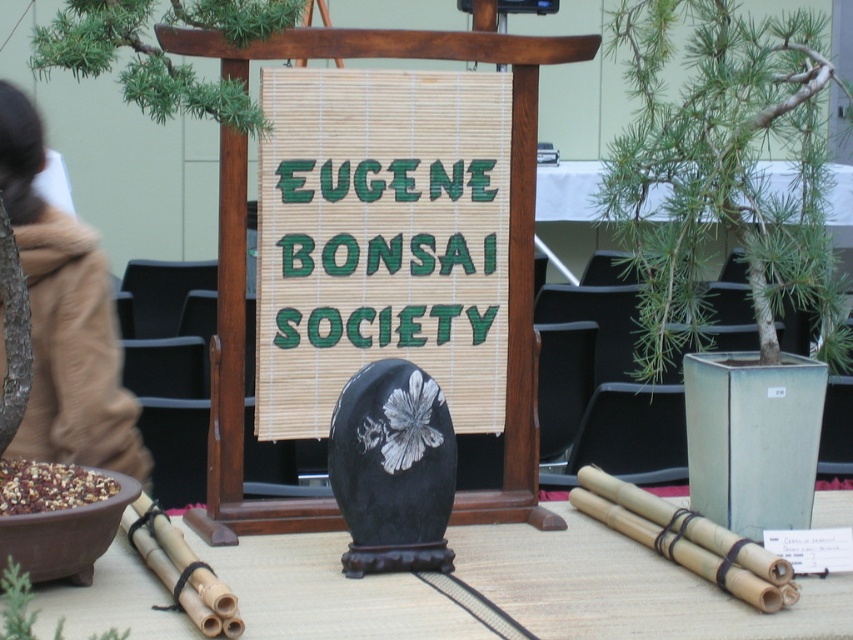
Question: Does smooth bamboo sticks at center have a smaller size compared to green leafy tree at upper left?

Choices:
 (A) yes
 (B) no

Answer: (B)

Question: Which of these objects is positioned closest to the green leafy bonsai at right?

Choices:
 (A) green matte bamboo at lower left
 (B) green leafy tree at upper left
 (C) bamboo mat at center
 (D) smooth bamboo sticks at center

Answer: (C)

Question: Is the position of green leafy tree at upper left less distant than that of green matte bamboo at lower left?

Choices:
 (A) yes
 (B) no

Answer: (B)

Question: Estimate the real-world distances between objects in this image. Which object is farther from the green leafy tree at upper left?

Choices:
 (A) bamboo mat at center
 (B) green matte bamboo at lower left
 (C) smooth bamboo sticks at center

Answer: (C)

Question: Does smooth bamboo sticks at center have a smaller size compared to green matte bamboo at lower left?

Choices:
 (A) yes
 (B) no

Answer: (B)

Question: Which of the following is the closest to the observer?

Choices:
 (A) smooth bamboo sticks at center
 (B) green leafy tree at upper left
 (C) bamboo mat at center

Answer: (A)